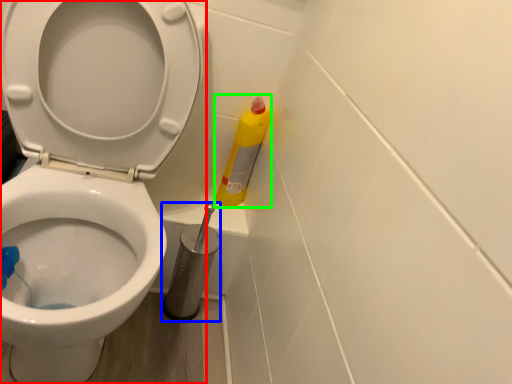
Question: Which object is the closest to the toilet (highlighted by a red box)? Choose among these: brush (highlighted by a blue box) or cleaning product (highlighted by a green box).

Choices:
 (A) brush
 (B) cleaning product

Answer: (A)